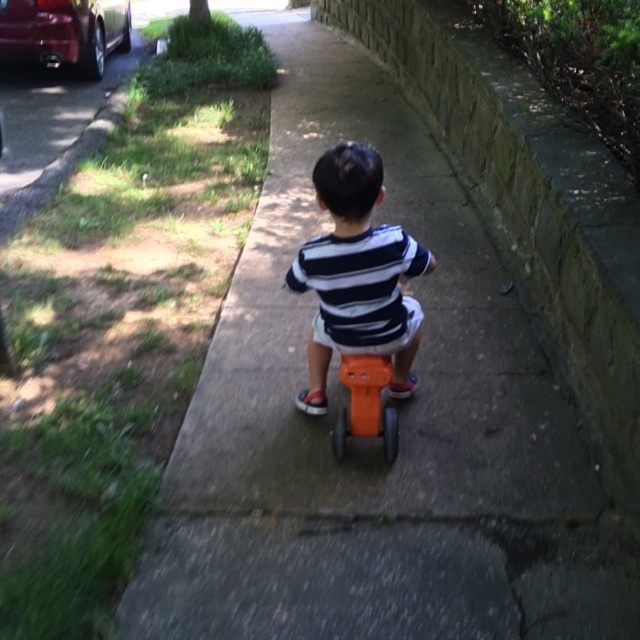
Question: Which of the following is the farthest from the observer?

Choices:
 (A) metallic red car at upper left
 (B) orange plastic toy at center

Answer: (A)

Question: Does matte orange plastic tricycle at center appear under orange plastic toy at center?

Choices:
 (A) no
 (B) yes

Answer: (A)

Question: Estimate the real-world distances between objects in this image. Which object is closer to the orange plastic toy at center?

Choices:
 (A) matte orange plastic tricycle at center
 (B) metallic red car at upper left

Answer: (A)

Question: Can you confirm if metallic red car at upper left is positioned above orange plastic toy at center?

Choices:
 (A) no
 (B) yes

Answer: (B)

Question: Which object appears farthest from the camera in this image?

Choices:
 (A) orange plastic toy at center
 (B) matte orange plastic tricycle at center

Answer: (A)

Question: Does metallic red car at upper left come behind orange plastic toy at center?

Choices:
 (A) yes
 (B) no

Answer: (A)